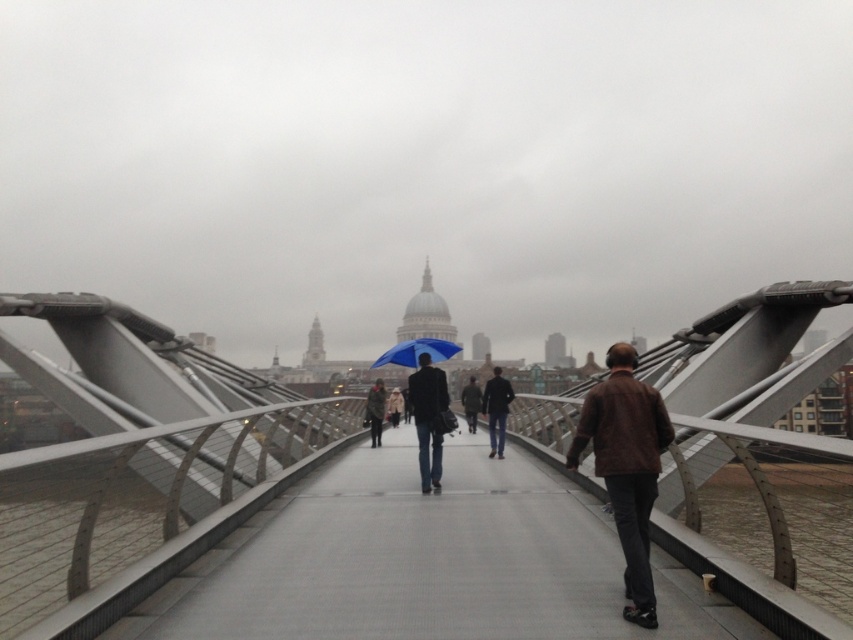
Is dark blue jacket at center positioned behind dark brown leather jacket at center?

No, it is not.

Does dark blue jacket at center appear under dark brown leather jacket at center?

No.

Is point (495, 412) positioned behind point (471, 406)?

No, (495, 412) is in front of (471, 406).

Locate an element on the screen. Image resolution: width=853 pixels, height=640 pixels. dark blue jacket at center is located at coordinates (496, 410).

Can you confirm if brown leather jacket at center is wider than blue fabric umbrella at center?

No, brown leather jacket at center is not wider than blue fabric umbrella at center.

Who is more distant from viewer, [640,600] or [440,360]?

Point [440,360]

Find the location of a particular element. brown leather jacket at center is located at coordinates (625, 465).

Can you confirm if metallic gray suspension bridge at center is taller than brown leather jacket at center?

Yes.

Which is behind, point (51, 627) or point (642, 584)?

Positioned behind is point (642, 584).

Identify the location of metallic gray suspension bridge at center. (138, 474).